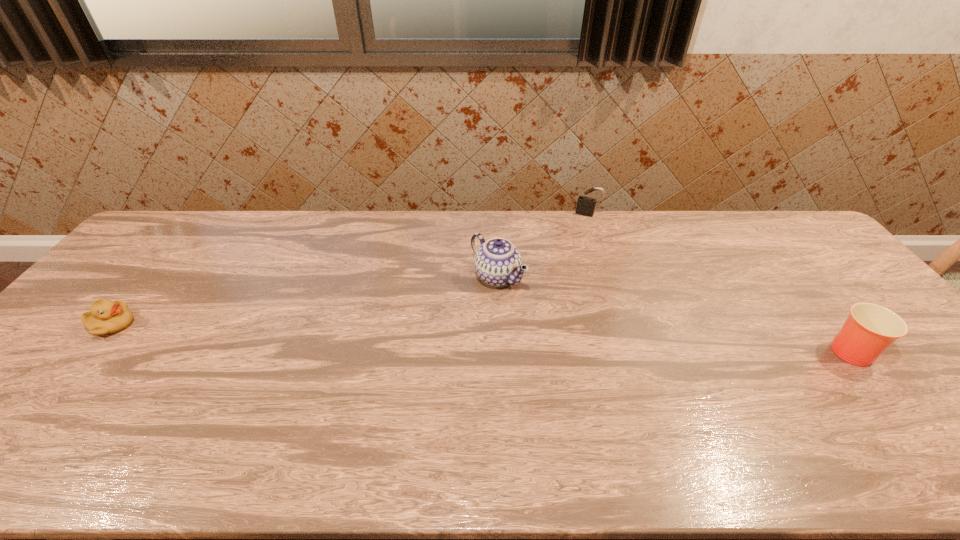
Image resolution: width=960 pixels, height=540 pixels. I want to click on duckling, so click(x=105, y=317).

In order to click on the leftmost object in this screenshot , I will do `click(105, 317)`.

Find the location of a particular element. cup is located at coordinates (870, 329).

Find the location of `the third nearest object`. the third nearest object is located at coordinates (498, 262).

This screenshot has width=960, height=540. What are the coordinates of `chinaware` in the screenshot? It's located at (498, 262).

Identify the location of the farthest object. (586, 205).

Identify the location of the second object from right to left. (586, 205).

Where is `blank space located at the beak of the leftmost object`? The width and height of the screenshot is (960, 540). blank space located at the beak of the leftmost object is located at coordinates (178, 325).

Where is `vacant area situated 0.120m on the back of the rightmost object`? This screenshot has height=540, width=960. vacant area situated 0.120m on the back of the rightmost object is located at coordinates (806, 295).

Locate an element on the screen. This screenshot has height=540, width=960. vacant space located at the spout of the third object from right to left is located at coordinates (422, 320).